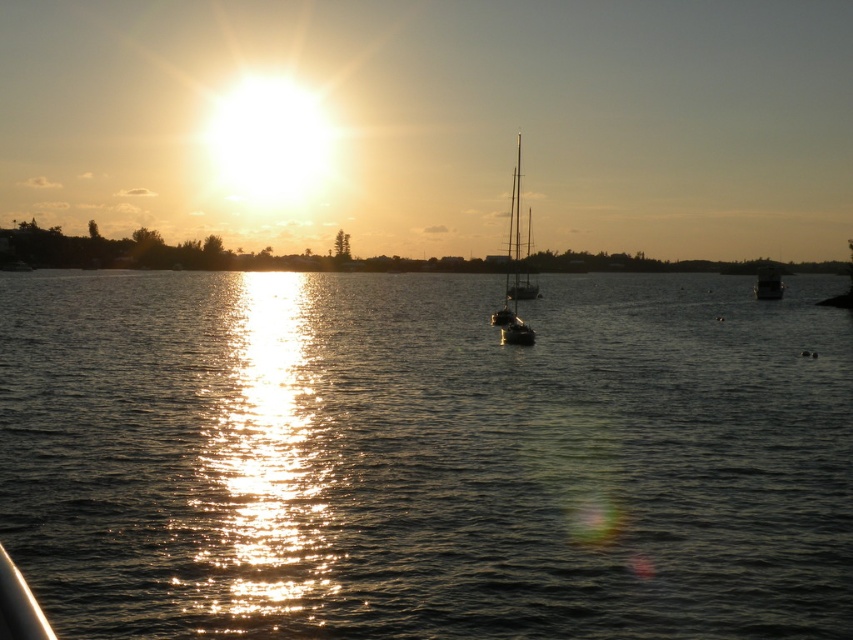
Question: Can you confirm if silhouette sailboat at center is positioned to the right of metallic silver boat at right?

Choices:
 (A) no
 (B) yes

Answer: (A)

Question: Does shiny reflective water at center appear on the left side of silhouette sailboat at center?

Choices:
 (A) yes
 (B) no

Answer: (A)

Question: Is shiny reflective water at center closer to the viewer compared to silhouette sailboat at center?

Choices:
 (A) no
 (B) yes

Answer: (B)

Question: Estimate the real-world distances between objects in this image. Which object is farther from the metallic silver boat at right?

Choices:
 (A) silhouette sailboat at center
 (B) shiny reflective water at center

Answer: (A)

Question: Which point is farther to the camera?

Choices:
 (A) shiny reflective water at center
 (B) silhouette sailboat at center

Answer: (B)

Question: Which point is farther to the camera?

Choices:
 (A) shiny reflective water at center
 (B) silhouette sailboat at center

Answer: (B)